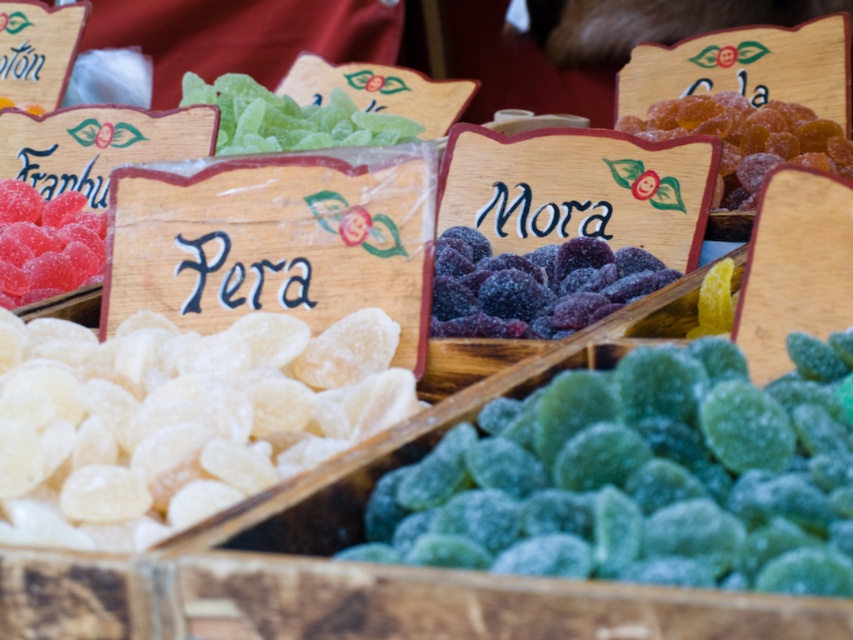
You are a customer at a candy store looking at the trays. You want to grab the green sugared candy at center and the glossy amber gummy at upper right. Which one should you reach for first if you want to pick the one closer to you?

The green sugared candy at center is located below the glossy amber gummy at upper right, so it is closer to you. You should reach for the green sugared candy at center first.

You are a customer at a candy store and want to buy the larger of the two candies you see. Which one should you choose between the green sugared candy at center and the glossy pink candy at upper left?

The green sugared candy at center is larger in size than the glossy pink candy at upper left, so you should choose the green sugared candy at center.

You are a customer at a candy store and want to find the green sugared candy at center and the glossy pink candy at upper left. Based on the scene description, which candy is positioned to the right of the other?

The green sugared candy at center is to the right of the glossy pink candy at upper left.